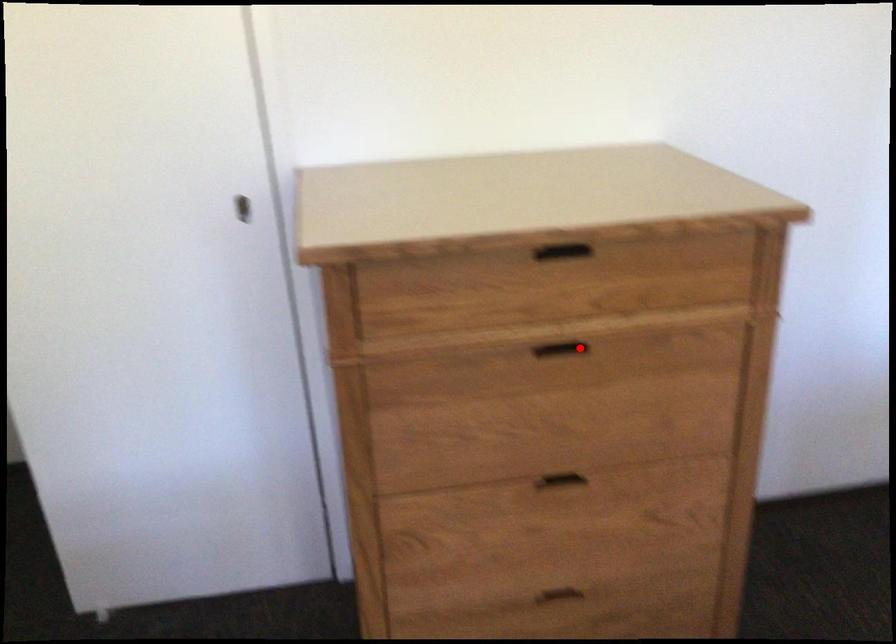
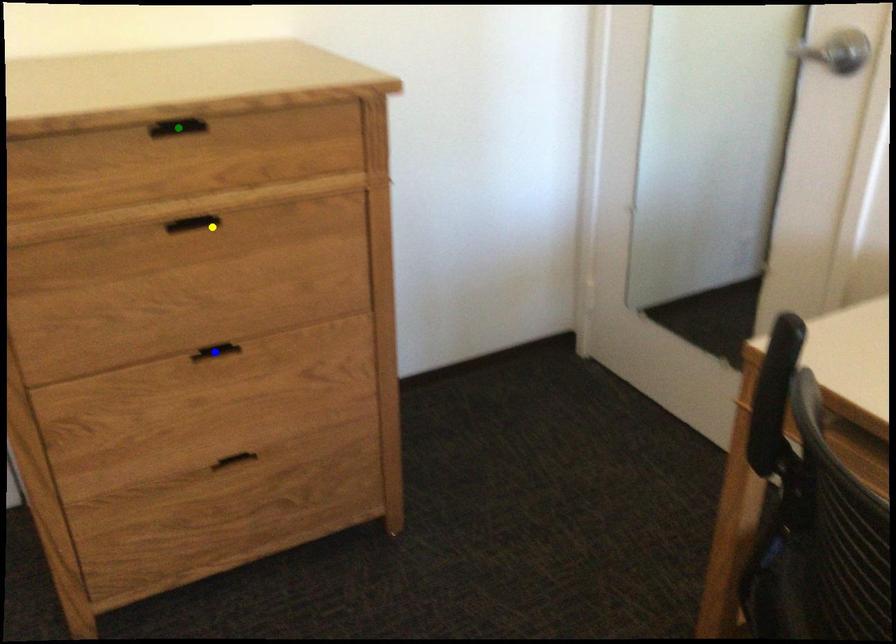
Question: I am providing you with two images of the same scene from different viewpoints. A red point is marked on the first image. You are given multiple points on the second image. Can you choose the point in image 2 that corresponds to the point in image 1?

Choices:
 (A) green point
 (B) blue point
 (C) yellow point

Answer: (C)